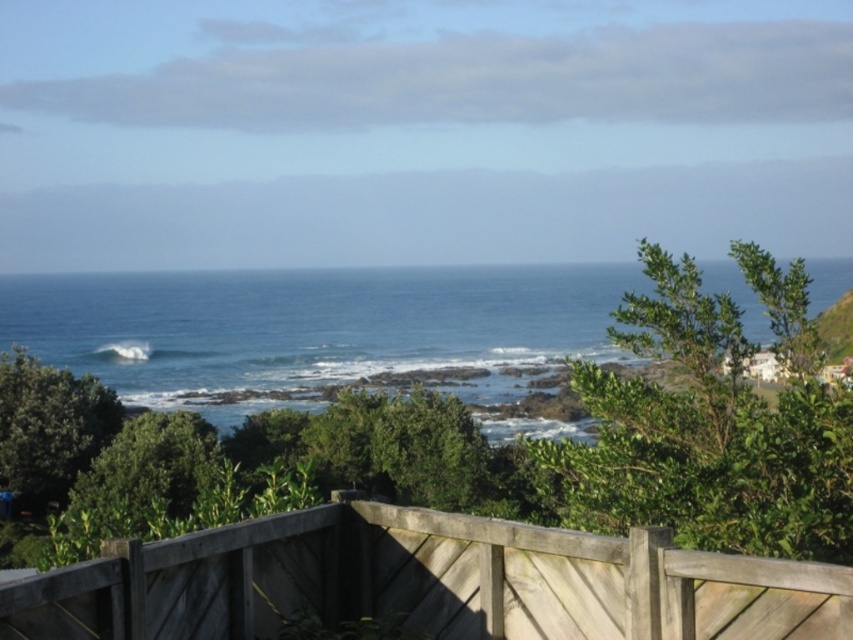
Question: Which of the following is the closest to the observer?

Choices:
 (A) (508, 321)
 (B) (96, 580)
 (C) (109, 355)

Answer: (B)

Question: Which point is farther from the camera taking this photo?

Choices:
 (A) (138, 403)
 (B) (123, 344)

Answer: (B)

Question: From the image, what is the correct spatial relationship of wooden fence at lower center in relation to white frothy wave at lower left?

Choices:
 (A) left
 (B) right

Answer: (B)

Question: Does blue water at center have a smaller size compared to white frothy wave at lower left?

Choices:
 (A) no
 (B) yes

Answer: (A)

Question: Among these objects, which one is farthest from the camera?

Choices:
 (A) wooden fence at lower center
 (B) white frothy wave at lower left

Answer: (B)

Question: Does wooden fence at lower center have a greater width compared to blue water at center?

Choices:
 (A) yes
 (B) no

Answer: (B)